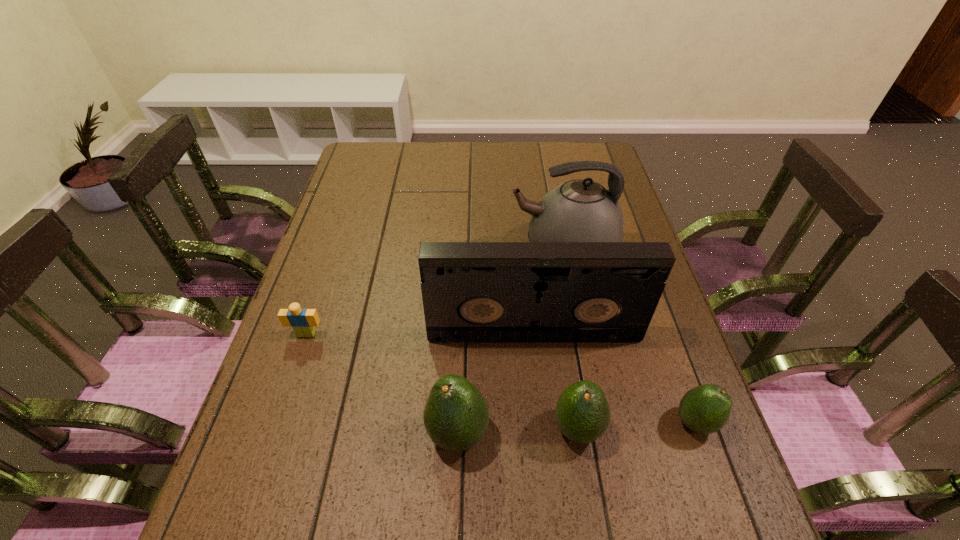
This screenshot has width=960, height=540. I want to click on kettle located in the right edge section of the desktop, so click(580, 210).

The width and height of the screenshot is (960, 540). I want to click on object at the near right corner, so click(705, 409).

Locate an element on the screen. vacant space at the far edge of the desktop is located at coordinates (422, 157).

You are a GUI agent. You are given a task and a screenshot of the screen. Output one action in this format:
    pyautogui.click(x=<x>, y=<y>)
    Task: Click on the free space at the near edge of the desktop
    
    Given the screenshot: What is the action you would take?
    pyautogui.click(x=514, y=441)

Identify the location of free space at the left edge of the desktop. (368, 234).

At what (x,y) coordinates should I click in order to perform the action: click on free space between the rightmost avocado and the videotape. Please return your answer as a coordinate pair (x, y). Looking at the image, I should click on (614, 378).

Identify the location of vacant area that lies between the third shortest object and the leftmost avocado. The image size is (960, 540). (517, 431).

Where is `free spot between the leftmost avocado and the videotape`? free spot between the leftmost avocado and the videotape is located at coordinates (496, 384).

At what (x,y) coordinates should I click in order to perform the action: click on unoccupied position between the videotape and the leftmost object. Please return your answer as a coordinate pair (x, y). This screenshot has width=960, height=540. Looking at the image, I should click on (420, 334).

Where is `free space between the leftmost avocado and the second avocado from right to left`? free space between the leftmost avocado and the second avocado from right to left is located at coordinates (517, 431).